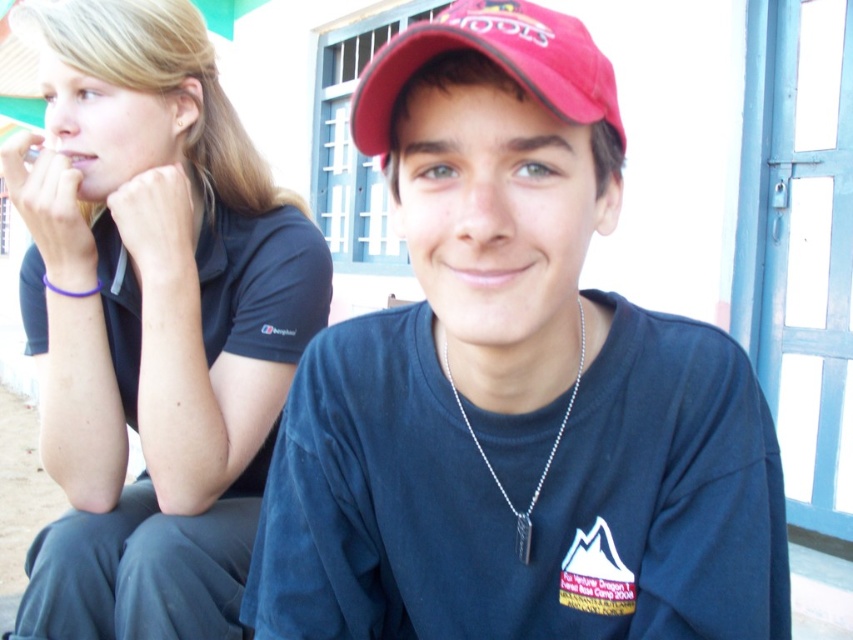
You are a photographer adjusting your camera settings. You notice the matte black shirt at center and the silver chain at center in your frame. Which object should you focus on first if you want to ensure both are in sharp focus?

The matte black shirt at center is taller than the silver chain at center, so focusing on the matte black shirt at center first will help ensure both are in sharp focus since it is the larger object in the frame.

You are holding a camera and want to take a closeup shot of the matte black shirt at center. The camera requires a minimum distance of 20 inches to focus properly. Can you take the photo without moving closer?

The matte black shirt at center is 21.58 inches away from the viewer, which is beyond the camera minimum focusing distance of 20 inches. Therefore, you can take the photo without moving closer.

Consider the image. You are a photographer adjusting your camera to focus on two points in the scene. The first point is at coordinates point (576, 348) and the second is at point (523, 74). Which point should you focus on first if you want to ensure the closest object is in focus?

Point (576, 348) is further to the camera than point (523, 74), so you should focus on point (576, 348) first to ensure the closest object is in focus.